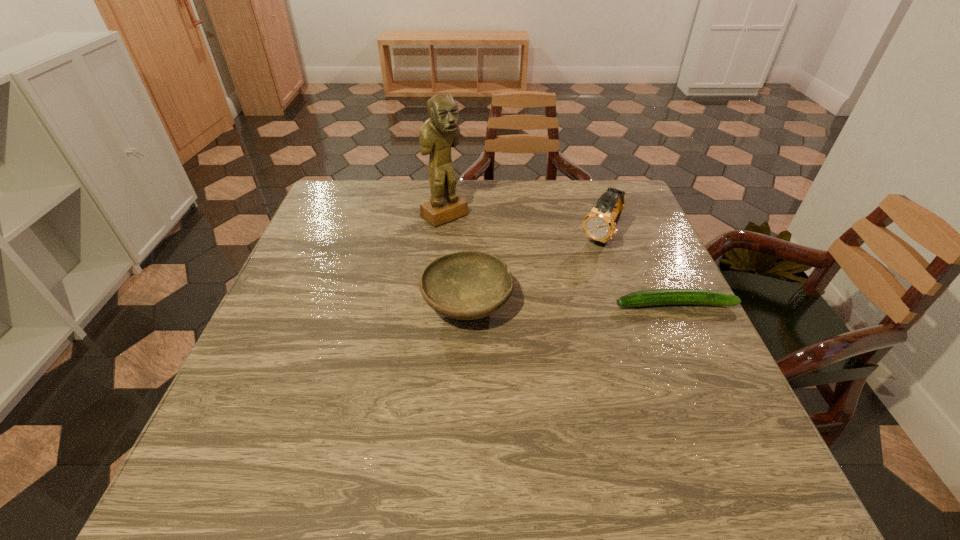
Locate an element on the screen. blank space located on the face of the watch is located at coordinates (530, 331).

At what (x,y) coordinates should I click in order to perform the action: click on figurine that is positioned at the far edge. Please return your answer as a coordinate pair (x, y). Looking at the image, I should click on (441, 131).

At what (x,y) coordinates should I click in order to perform the action: click on watch that is at the far edge. Please return your answer as a coordinate pair (x, y). The width and height of the screenshot is (960, 540). Looking at the image, I should click on pyautogui.click(x=599, y=224).

Where is `zucchini that is at the right edge`? The image size is (960, 540). zucchini that is at the right edge is located at coordinates (655, 297).

Image resolution: width=960 pixels, height=540 pixels. Identify the location of watch positioned at the right edge. (599, 224).

At what (x,y) coordinates should I click in order to perform the action: click on object at the far right corner. Please return your answer as a coordinate pair (x, y). This screenshot has width=960, height=540. Looking at the image, I should click on (599, 224).

Image resolution: width=960 pixels, height=540 pixels. In the image, there is a desktop. In order to click on vacant space at the far edge in this screenshot , I will do `click(464, 188)`.

In the image, there is a desktop. In order to click on vacant space at the near edge in this screenshot , I will do `click(446, 420)`.

This screenshot has height=540, width=960. Identify the location of vacant area at the left edge of the desktop. (294, 293).

The image size is (960, 540). What are the coordinates of `free space at the right edge of the desktop` in the screenshot? It's located at (668, 262).